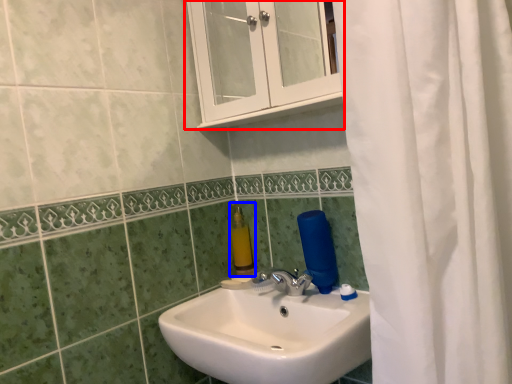
Question: Which of the following is the closest to the observer, medicine cabinet (highlighted by a red box) or soap dispenser (highlighted by a blue box)?

Choices:
 (A) medicine cabinet
 (B) soap dispenser

Answer: (A)